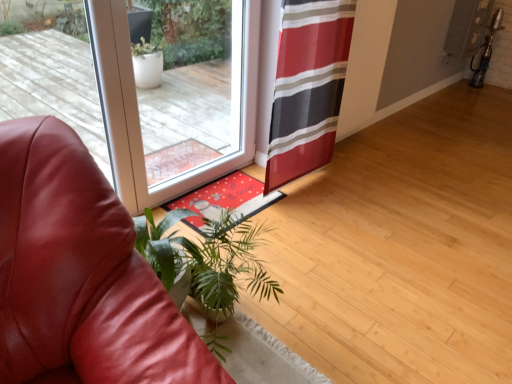
Question: Does point (51, 59) appear closer or farther from the camera than point (231, 309)?

Choices:
 (A) farther
 (B) closer

Answer: (A)

Question: Would you say transparent glass door at center is inside or outside green leafy plant at lower left?

Choices:
 (A) outside
 (B) inside

Answer: (A)

Question: Estimate the real-world distances between objects in this image. Which object is farther from the leather couch at lower left?

Choices:
 (A) transparent glass door at center
 (B) green leafy plant at lower left
 (C) red and black striped curtain at center

Answer: (C)

Question: Based on their relative distances, which object is nearer to the green leafy plant at lower left?

Choices:
 (A) red and black striped curtain at center
 (B) leather couch at lower left
 (C) transparent glass door at center

Answer: (B)